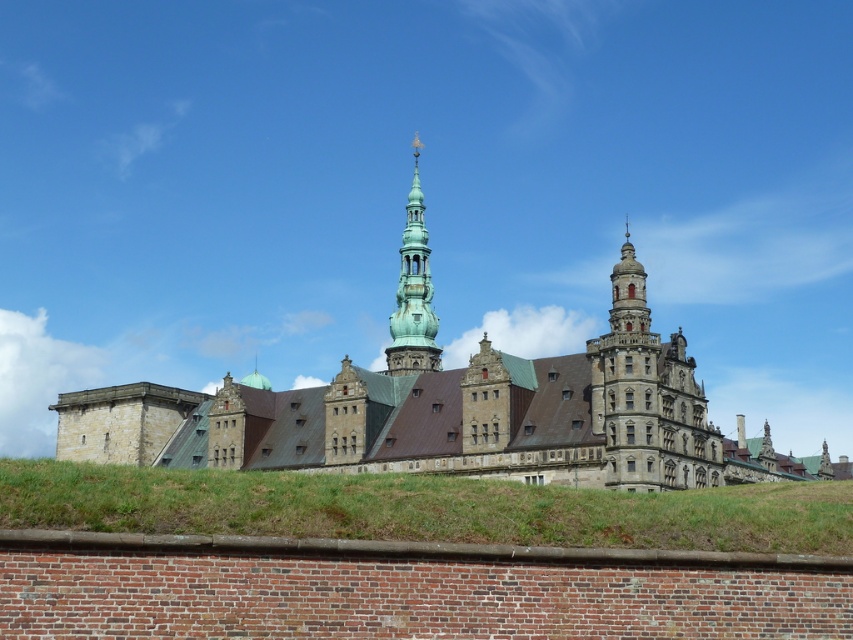
You are a landscape architect designing a garden around the stone castle at center and green grass at lower center. Which object occupies more horizontal space in the image?

The stone castle at center has a greater width than the green grass at lower center, so the stone castle at center occupies more horizontal space in the image.

You are a tourist standing in front of the stone castle at center. You notice the green grass at lower center nearby. Which object takes up more space in the image?

The stone castle at center is larger in size than the green grass at lower center, so the stone castle at center takes up more space in the image.

You are an architect designing a new garden layout around the stone castle at center and the green copper tower at center. To ensure proper visibility, you need to know which structure is bigger. Which one should you consider as the larger one for planning purposes?

The stone castle at center is larger in size compared to the green copper tower at center, so you should consider the stone castle at center as the larger one for planning purposes.